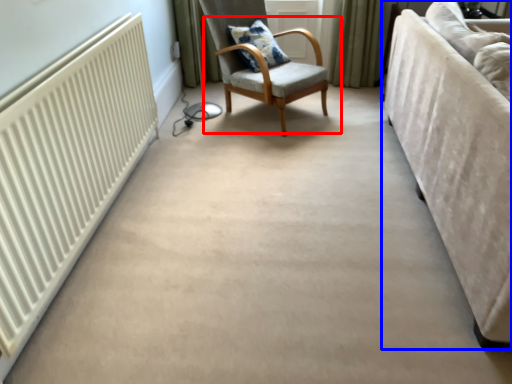
Question: Which point is further to the camera, chair (highlighted by a red box) or studio couch (highlighted by a blue box)?

Choices:
 (A) chair
 (B) studio couch

Answer: (A)